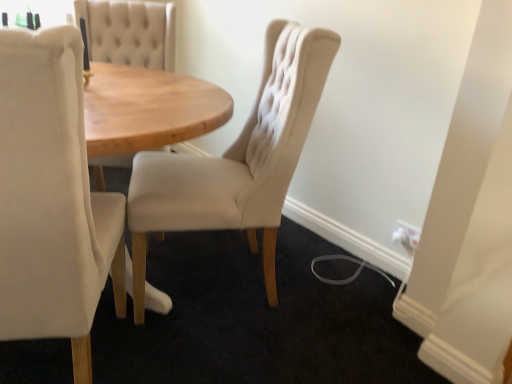
Image resolution: width=512 pixels, height=384 pixels. Find the location of `free space in front of beige fabric chair at center, which is the 1th chair in right-to-left order`. free space in front of beige fabric chair at center, which is the 1th chair in right-to-left order is located at coordinates (217, 349).